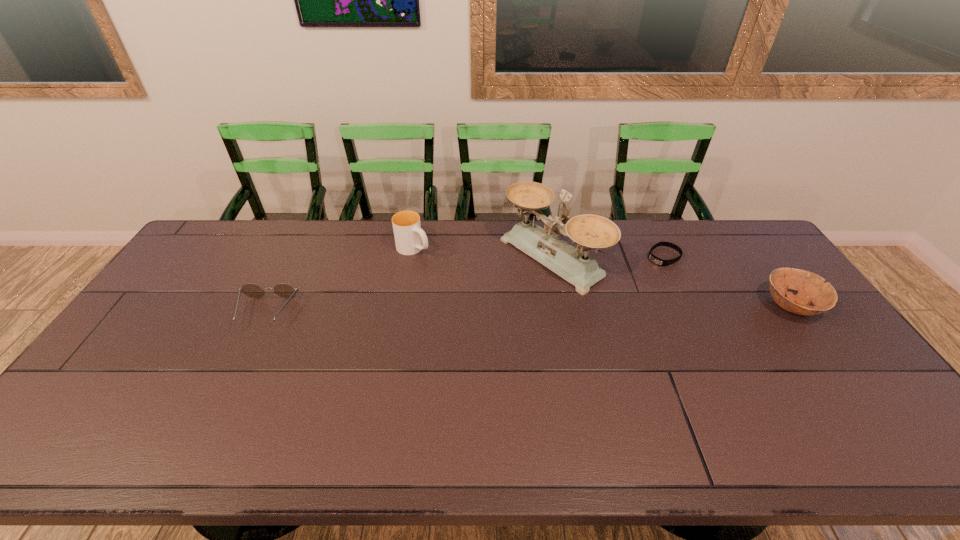
The height and width of the screenshot is (540, 960). In order to click on free region located on the front-facing side of the spectacles in this screenshot , I will do `click(230, 384)`.

I want to click on vacant space located on the left of the bowl, so click(x=653, y=306).

Locate an element on the screen. blank space located 0.270m on the display of the second object from right to left is located at coordinates (600, 298).

Find the location of a particular element. Image resolution: width=960 pixels, height=540 pixels. vacant space located 0.180m on the display of the second object from right to left is located at coordinates (619, 285).

Locate an element on the screen. The width and height of the screenshot is (960, 540). vacant area located 0.060m on the display of the second object from right to left is located at coordinates (642, 270).

The width and height of the screenshot is (960, 540). I want to click on vacant space situated with the handle on the side of the cup, so click(473, 288).

The image size is (960, 540). I want to click on free location located 0.220m with the handle on the side of the cup, so click(x=471, y=286).

At what (x,y) coordinates should I click in order to perform the action: click on vacant area situated with the handle on the side of the cup. Please return your answer as a coordinate pair (x, y). The height and width of the screenshot is (540, 960). Looking at the image, I should click on (483, 294).

You are a GUI agent. You are given a task and a screenshot of the screen. Output one action in this format:
    pyautogui.click(x=<x>, y=<y>)
    Task: Click on the free point located on the front-facing side of the scale
    
    Given the screenshot: What is the action you would take?
    pyautogui.click(x=452, y=322)

The image size is (960, 540). Identify the location of free location located on the front-facing side of the scale. (460, 317).